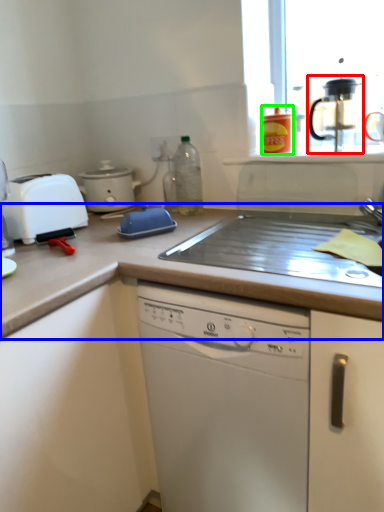
Question: Which object is the closest to the coffee machine (highlighted by a red box)? Choose among these: countertop (highlighted by a blue box) or kitchen appliance (highlighted by a green box).

Choices:
 (A) countertop
 (B) kitchen appliance

Answer: (B)